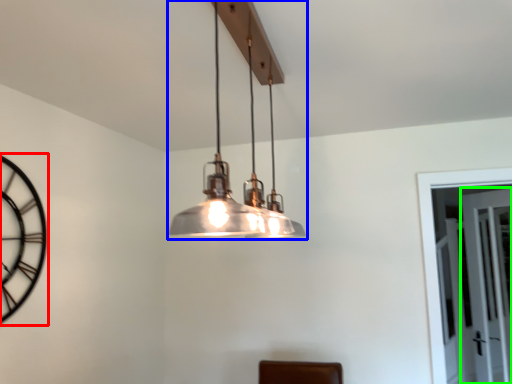
Question: Which object is positioned closest to clock (highlighted by a red box)? Select from lamp (highlighted by a blue box) and glass door (highlighted by a green box).

Choices:
 (A) lamp
 (B) glass door

Answer: (A)